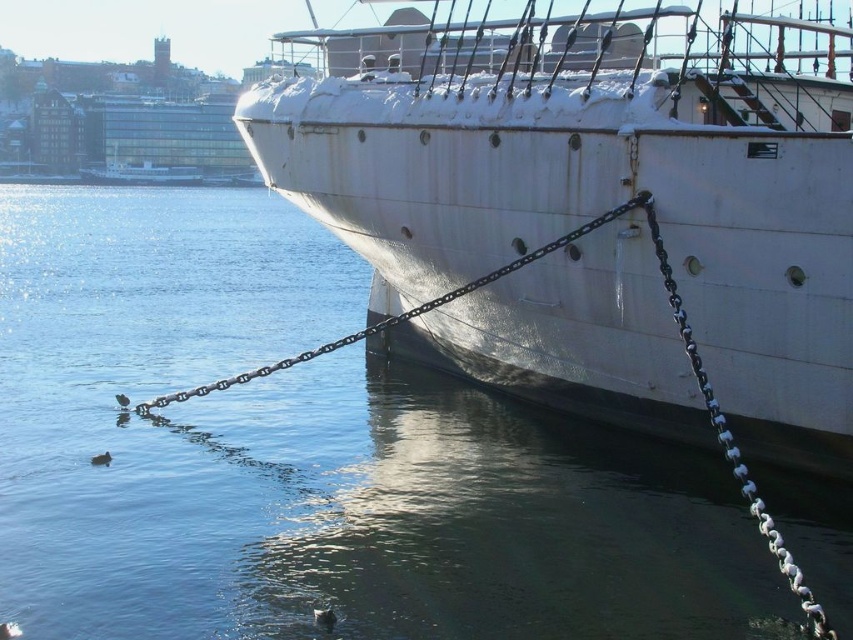
You are a photographer standing on the pier and want to capture both the clear water at lower left and the metallic chain at lower center in the same frame. Which object should you position closer to the left side of your camera viewfinder to include both in the photo?

The clear water at lower left is positioned on the left side of metallic chain at lower center, so you should position the clear water at lower left closer to the left side of your camera viewfinder to include both in the photo.

You are a dock worker inspecting the ship. You notice two metallic chains attached to the ship. Which chain, the silver metallic chain at right or the metallic chain at lower center, is positioned further to the right side of the image?

The silver metallic chain at right is positioned further to the right side of the image compared to the metallic chain at lower center.

You are standing on the pier and want to board the white matte ship at center. There is a silver metallic chain at right blocking your path. Can you walk around the chain to reach the ship?

The white matte ship at center is further to the viewer than the silver metallic chain at right, meaning the chain is behind the ship. Since the chain is anchored into the water, you can walk around it to reach the ship.